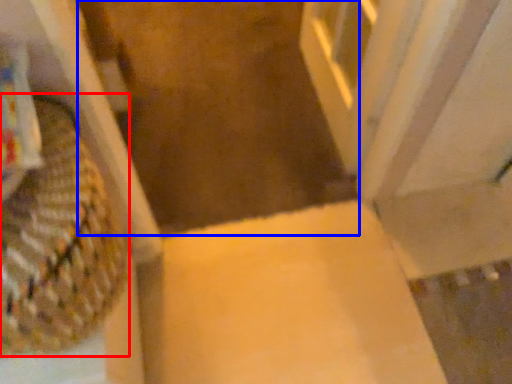
Question: Among these objects, which one is farthest to the camera, basket (highlighted by a red box) or aisle (highlighted by a blue box)?

Choices:
 (A) basket
 (B) aisle

Answer: (B)